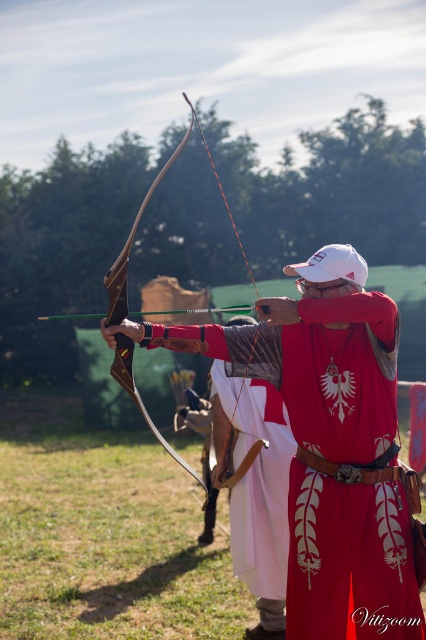
Question: Which point appears closest to the camera in this image?

Choices:
 (A) (324, 625)
 (B) (167, 160)

Answer: (A)

Question: Is leather bow at center bigger than wooden bow at center?

Choices:
 (A) no
 (B) yes

Answer: (A)

Question: Is leather bow at center bigger than wooden bow at center?

Choices:
 (A) no
 (B) yes

Answer: (A)

Question: Which of the following is the farthest from the observer?

Choices:
 (A) (132, 339)
 (B) (137, 396)

Answer: (A)

Question: Is leather bow at center thinner than wooden bow at center?

Choices:
 (A) yes
 (B) no

Answer: (A)